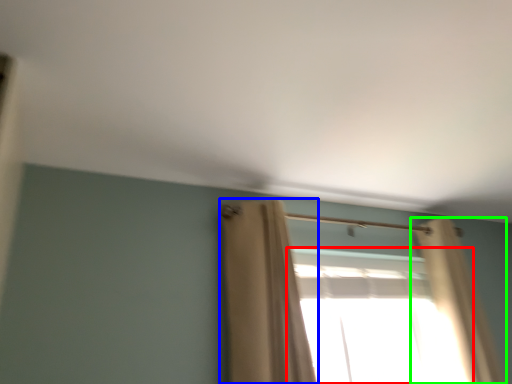
Question: Based on their relative distances, which object is nearer to window (highlighted by a red box)? Choose from curtain (highlighted by a blue box) and curtain (highlighted by a green box).

Choices:
 (A) curtain
 (B) curtain

Answer: (B)